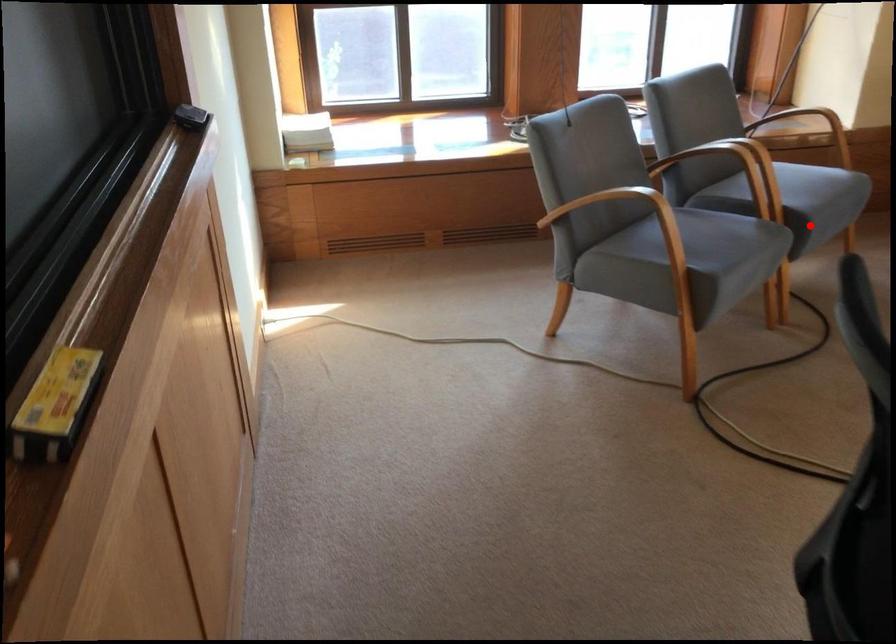
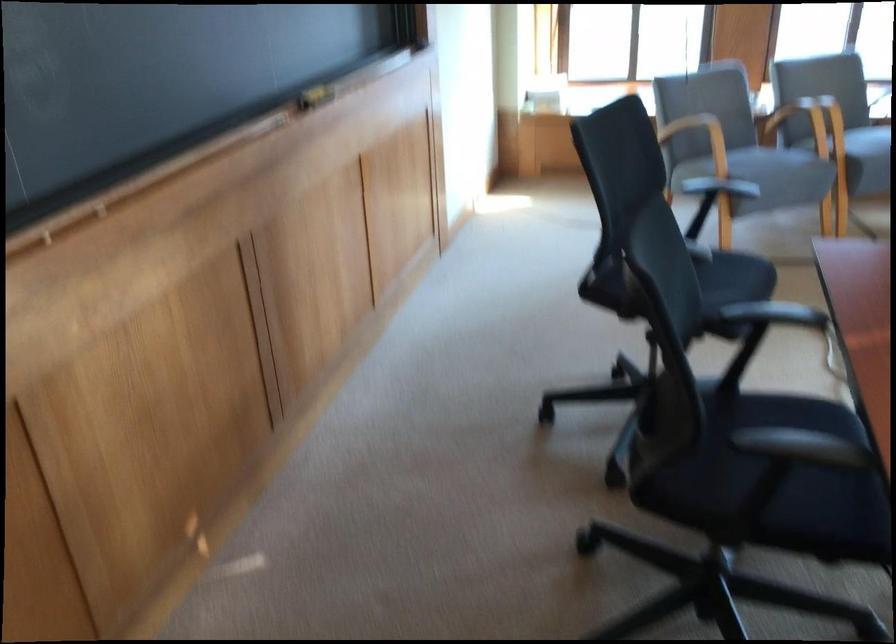
Question: I am providing you with two images of the same scene from different viewpoints. Image1 has a red point marked. In image2, the corresponding 3D location appears at what relative position? Reply with the corresponding letter.

Choices:
 (A) Closer
 (B) Farther

Answer: (B)